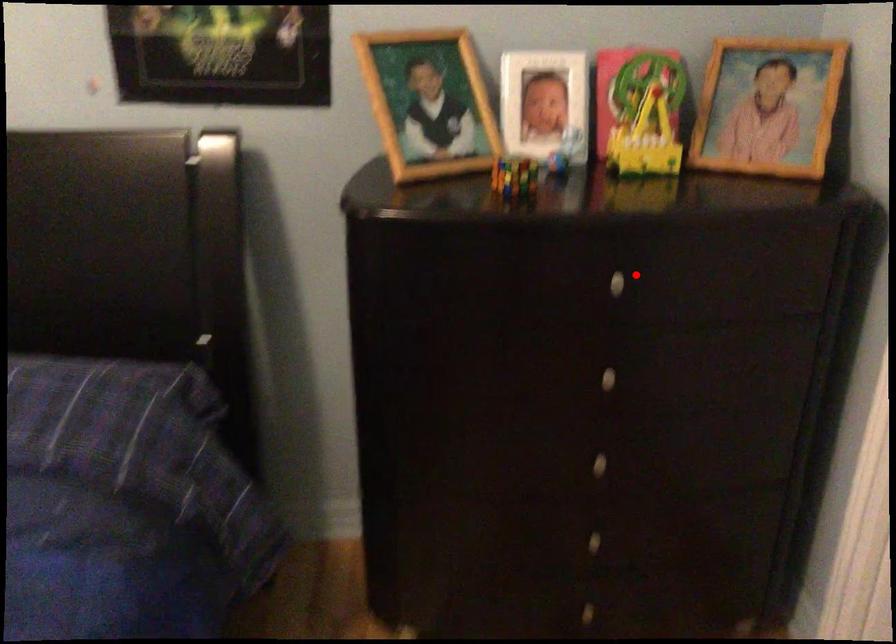
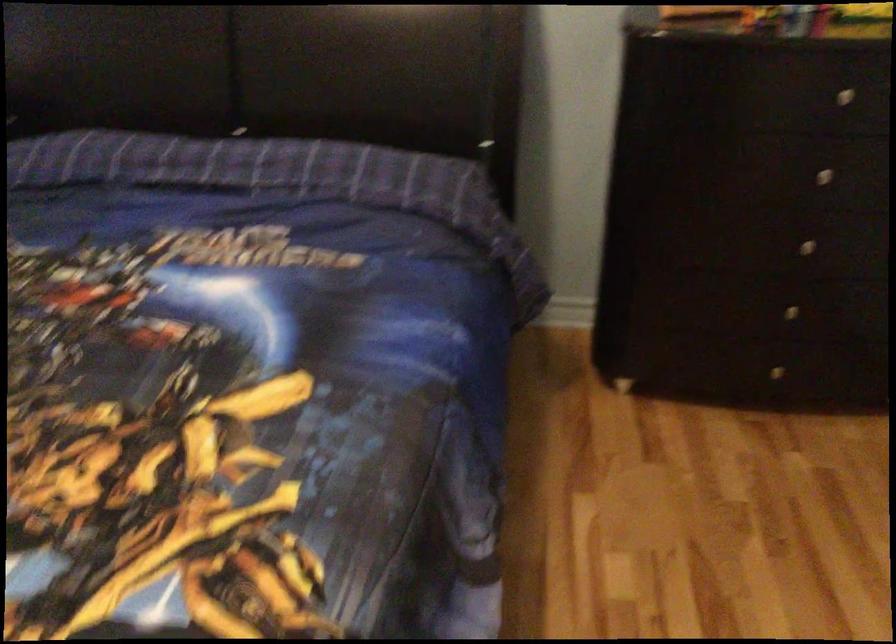
Question: I am providing you with two images of the same scene from different viewpoints. In image1, a red point is highlighted. Considering the same 3D point in image2, which of the following is correct?

Choices:
 (A) It is closer
 (B) It is farther

Answer: (B)